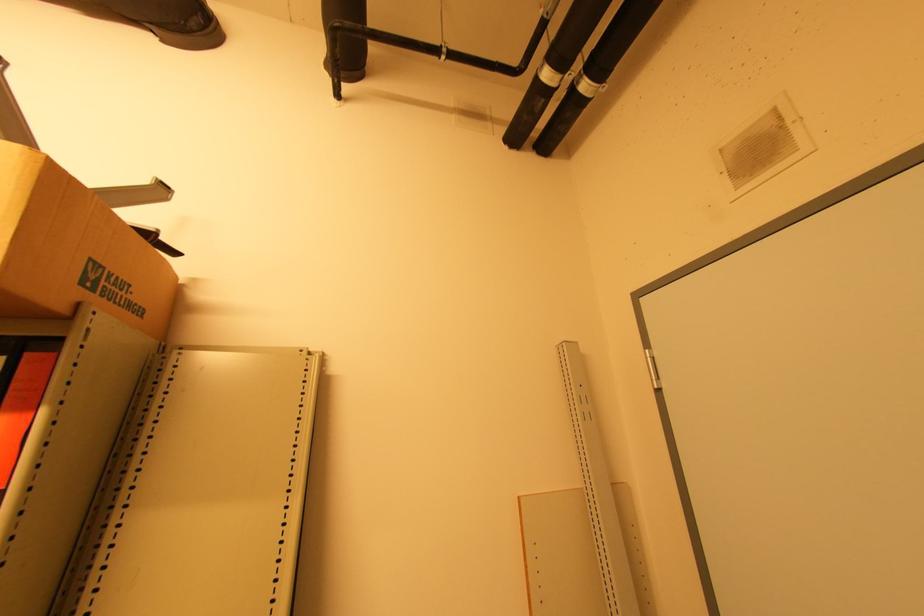
This screenshot has height=616, width=924. I want to click on cardboard box, so click(x=73, y=249).